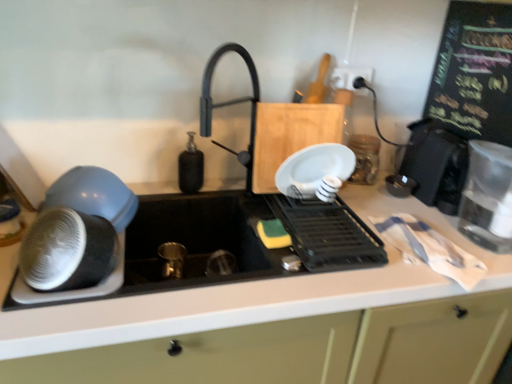
Measure the distance between point (412, 329) and camera.

38.15 inches.

Describe the element at coordinates (436, 165) in the screenshot. I see `black plastic toaster at right, arranged as the first appliance when viewed from the right` at that location.

Where is `black plastic toaster at right, the 4th appliance positioned from the left`? The image size is (512, 384). black plastic toaster at right, the 4th appliance positioned from the left is located at coordinates (436, 165).

This screenshot has height=384, width=512. Identify the location of white plastic electric outlet at upper right. (350, 78).

What do you see at coordinates (94, 195) in the screenshot?
I see `matte blue bowl at left, the first kitchen appliance from the left` at bounding box center [94, 195].

Based on the photo, in order to face matte blue bowl at left, positioned as the second kitchen appliance in right-to-left order, should I rotate leftwards or rightwards?

To face it directly, rotate left by 20.864 degrees.

Describe the element at coordinates (190, 167) in the screenshot. The width and height of the screenshot is (512, 384). I see `black matte soap dispenser at center` at that location.

This screenshot has width=512, height=384. What are the coordinates of `clear glass water at right, the 2th kitchen appliance positioned from the left` in the screenshot? It's located at (488, 197).

What do you see at coordinates (365, 158) in the screenshot?
I see `clear glass jar at upper right, placed as the second appliance when sorted from right to left` at bounding box center [365, 158].

Where is `white matte countertop at center`? This screenshot has width=512, height=384. white matte countertop at center is located at coordinates (249, 318).

Is black plastic dish rack at center, positioned as the second appliance in left-to-right order, positioned behind white matte countertop at center?

That is True.

Who is taller, black plastic dish rack at center, arranged as the third appliance when viewed from the right, or white matte countertop at center?

Standing taller between the two is white matte countertop at center.

Between black plastic dish rack at center, positioned as the second appliance in left-to-right order, and white matte countertop at center, which one appears on the left side from the viewer's perspective?

white matte countertop at center is more to the left.

In the scene shown: Who is smaller, black plastic dish rack at center, positioned as the second appliance in left-to-right order, or white matte countertop at center?

With smaller size is black plastic dish rack at center, positioned as the second appliance in left-to-right order.

Is clear glass jar at upper right, placed as the second appliance when sorted from right to left, far away from black matte soap dispenser at center?

clear glass jar at upper right, placed as the second appliance when sorted from right to left, is actually quite close to black matte soap dispenser at center.

From the image's perspective, which one is positioned higher, clear glass jar at upper right, which appears as the 3th appliance when viewed from the left, or black matte soap dispenser at center?

clear glass jar at upper right, which appears as the 3th appliance when viewed from the left.

From a real-world perspective, is clear glass jar at upper right, placed as the second appliance when sorted from right to left, above or below black matte soap dispenser at center?

Clearly, from a real-world perspective, clear glass jar at upper right, placed as the second appliance when sorted from right to left, is below black matte soap dispenser at center.

Is clear glass jar at upper right, which appears as the 3th appliance when viewed from the left, oriented towards black matte soap dispenser at center?

No, clear glass jar at upper right, which appears as the 3th appliance when viewed from the left, is not oriented towards black matte soap dispenser at center.

From the picture: Are clear glass water at right, acting as the first kitchen appliance starting from the right, and black plastic toaster at right, arranged as the first appliance when viewed from the right, far apart?

No, clear glass water at right, acting as the first kitchen appliance starting from the right, is not far from black plastic toaster at right, arranged as the first appliance when viewed from the right.

Does clear glass water at right, acting as the first kitchen appliance starting from the right, appear on the left side of black plastic toaster at right, the 4th appliance positioned from the left?

No, clear glass water at right, acting as the first kitchen appliance starting from the right, is not to the left of black plastic toaster at right, the 4th appliance positioned from the left.

From the image's perspective, which one is positioned lower, clear glass water at right, the 2th kitchen appliance positioned from the left, or black plastic toaster at right, the 4th appliance positioned from the left?

clear glass water at right, the 2th kitchen appliance positioned from the left, appears lower in the image.

Looking at their sizes, would you say clear glass water at right, the 2th kitchen appliance positioned from the left, is wider or thinner than black plastic toaster at right, the 4th appliance positioned from the left?

clear glass water at right, the 2th kitchen appliance positioned from the left, is thinner than black plastic toaster at right, the 4th appliance positioned from the left.

Which point is more distant from viewer, (x=294, y=229) or (x=186, y=155)?

The point (x=186, y=155) is farther.

How many degrees apart are the facing directions of black plastic dish rack at center, positioned as the second appliance in left-to-right order, and black matte soap dispenser at center?

black plastic dish rack at center, positioned as the second appliance in left-to-right order, and black matte soap dispenser at center are facing 90 degrees away from each other.

Locate an element on the screen. bottle on the left of black plastic dish rack at center, arranged as the third appliance when viewed from the right is located at coordinates (190, 167).

Is black matte soap dispenser at center a part of black plastic dish rack at center, positioned as the second appliance in left-to-right order?

No, black matte soap dispenser at center is not a part of black plastic dish rack at center, positioned as the second appliance in left-to-right order.

Is clear glass jar at upper right, placed as the second appliance when sorted from right to left, in front of or behind matte black bowl at left, acting as the 4th appliance starting from the right, in the image?

Visually, clear glass jar at upper right, placed as the second appliance when sorted from right to left, is located behind matte black bowl at left, acting as the 4th appliance starting from the right.

Is clear glass jar at upper right, which appears as the 3th appliance when viewed from the left, oriented towards matte black bowl at left, acting as the 4th appliance starting from the right?

No, clear glass jar at upper right, which appears as the 3th appliance when viewed from the left, does not turn towards matte black bowl at left, acting as the 4th appliance starting from the right.

Considering the sizes of objects clear glass jar at upper right, placed as the second appliance when sorted from right to left, and matte black bowl at left, which ranks as the 1th appliance in left-to-right order, in the image provided, who is thinner, clear glass jar at upper right, placed as the second appliance when sorted from right to left, or matte black bowl at left, which ranks as the 1th appliance in left-to-right order,?

clear glass jar at upper right, placed as the second appliance when sorted from right to left, is thinner.

Which is more to the left, clear glass jar at upper right, which appears as the 3th appliance when viewed from the left, or matte black bowl at left, which ranks as the 1th appliance in left-to-right order?

Positioned to the left is matte black bowl at left, which ranks as the 1th appliance in left-to-right order.

Does matte blue bowl at left, positioned as the second kitchen appliance in right-to-left order, have a smaller size compared to black matte soap dispenser at center?

No.

Looking at this image, from a real-world perspective, is matte blue bowl at left, the first kitchen appliance from the left, above or below black matte soap dispenser at center?

matte blue bowl at left, the first kitchen appliance from the left, is situated lower than black matte soap dispenser at center in the real world.

Locate an element on the screen. Image resolution: width=512 pixels, height=384 pixels. bottle behind the matte blue bowl at left, positioned as the second kitchen appliance in right-to-left order is located at coordinates (190, 167).

Is matte blue bowl at left, positioned as the second kitchen appliance in right-to-left order, positioned behind black matte soap dispenser at center?

No.

From a real-world perspective, is black matte soap dispenser at center physically below matte blue bowl at left, the first kitchen appliance from the left?

No.

Would you say black matte soap dispenser at center is a long distance from matte blue bowl at left, positioned as the second kitchen appliance in right-to-left order?

No, black matte soap dispenser at center is not far away from matte blue bowl at left, positioned as the second kitchen appliance in right-to-left order.

From the image's perspective, is black matte soap dispenser at center over matte blue bowl at left, positioned as the second kitchen appliance in right-to-left order?

Yes, from the image's perspective, black matte soap dispenser at center is on top of matte blue bowl at left, positioned as the second kitchen appliance in right-to-left order.

Measure the distance from black matte soap dispenser at center to matte blue bowl at left, positioned as the second kitchen appliance in right-to-left order.

9.78 inches.

I want to click on countertop located below the black plastic dish rack at center, positioned as the second appliance in left-to-right order (from the image's perspective), so click(249, 318).

At what (x,y) coordinates should I click in order to perform the action: click on bottle that is above the clear glass jar at upper right, which appears as the 3th appliance when viewed from the left (from a real-world perspective). Please return your answer as a coordinate pair (x, y). This screenshot has height=384, width=512. Looking at the image, I should click on (190, 167).

Based on their spatial positions, is white plastic electric outlet at upper right or matte blue bowl at left, positioned as the second kitchen appliance in right-to-left order, closer to black plastic dish rack at center, positioned as the second appliance in left-to-right order?

matte blue bowl at left, positioned as the second kitchen appliance in right-to-left order, lies closer to black plastic dish rack at center, positioned as the second appliance in left-to-right order, than the other object.

From the image, which object appears to be farther from matte black bowl at left, acting as the 4th appliance starting from the right, white matte countertop at center or white plastic electric outlet at upper right?

The object further to matte black bowl at left, acting as the 4th appliance starting from the right, is white plastic electric outlet at upper right.

From the image, which object appears to be nearer to clear glass jar at upper right, placed as the second appliance when sorted from right to left, black plastic toaster at right, the 4th appliance positioned from the left, or white plastic electric outlet at upper right?

Based on the image, black plastic toaster at right, the 4th appliance positioned from the left, appears to be nearer to clear glass jar at upper right, placed as the second appliance when sorted from right to left.

From the picture: Based on their spatial positions, is clear glass water at right, acting as the first kitchen appliance starting from the right, or white plastic electric outlet at upper right further from matte blue bowl at left, the first kitchen appliance from the left?

clear glass water at right, acting as the first kitchen appliance starting from the right, lies further to matte blue bowl at left, the first kitchen appliance from the left, than the other object.

From the image, which object appears to be farther from clear glass water at right, the 2th kitchen appliance positioned from the left, clear glass jar at upper right, placed as the second appliance when sorted from right to left, or black matte soap dispenser at center?

black matte soap dispenser at center lies further to clear glass water at right, the 2th kitchen appliance positioned from the left, than the other object.

From the image, which object appears to be farther from matte black bowl at left, which ranks as the 1th appliance in left-to-right order, black matte soap dispenser at center or black plastic dish rack at center, positioned as the second appliance in left-to-right order?

black plastic dish rack at center, positioned as the second appliance in left-to-right order.

Looking at this image, looking at the image, which one is located further to clear glass water at right, acting as the first kitchen appliance starting from the right, clear glass jar at upper right, which appears as the 3th appliance when viewed from the left, or black plastic toaster at right, arranged as the first appliance when viewed from the right?

The object further to clear glass water at right, acting as the first kitchen appliance starting from the right, is clear glass jar at upper right, which appears as the 3th appliance when viewed from the left.

Looking at the image, which one is located further to black matte soap dispenser at center, clear glass jar at upper right, placed as the second appliance when sorted from right to left, or white plastic electric outlet at upper right?

Based on the image, clear glass jar at upper right, placed as the second appliance when sorted from right to left, appears to be further to black matte soap dispenser at center.

Locate an element on the screen. The image size is (512, 384). electric outlet between matte black bowl at left, acting as the 4th appliance starting from the right, and clear glass jar at upper right, placed as the second appliance when sorted from right to left, in the horizontal direction is located at coordinates (350, 78).

Where is `electric outlet between clear glass water at right, acting as the first kitchen appliance starting from the right, and clear glass jar at upper right, which appears as the 3th appliance when viewed from the left, in the front-back direction`? Image resolution: width=512 pixels, height=384 pixels. electric outlet between clear glass water at right, acting as the first kitchen appliance starting from the right, and clear glass jar at upper right, which appears as the 3th appliance when viewed from the left, in the front-back direction is located at coordinates (350, 78).

At what (x,y) coordinates should I click in order to perform the action: click on bottle located between matte blue bowl at left, the first kitchen appliance from the left, and clear glass jar at upper right, placed as the second appliance when sorted from right to left, in the left-right direction. Please return your answer as a coordinate pair (x, y). Looking at the image, I should click on [x=190, y=167].

Where is `countertop situated between black matte soap dispenser at center and black plastic toaster at right, the 4th appliance positioned from the left, from left to right`? countertop situated between black matte soap dispenser at center and black plastic toaster at right, the 4th appliance positioned from the left, from left to right is located at coordinates (x=249, y=318).